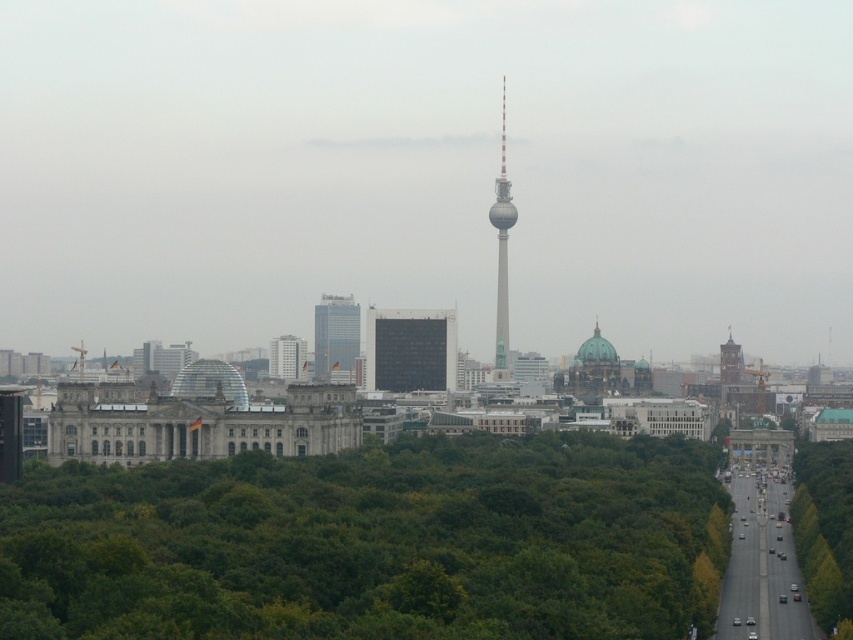
Who is positioned more to the left, black glass building at center or matte glass building at center?

From the viewer's perspective, matte glass building at center appears more on the left side.

Who is lower down, black glass building at center or matte glass building at center?

matte glass building at center is lower down.

Between point (408, 308) and point (277, 360), which one is positioned in front?

Point (408, 308) is in front.

Identify the location of black glass building at center. Image resolution: width=853 pixels, height=640 pixels. (410, 349).

Does green leafy trees at center appear on the right side of green leafy tree at right?

No, green leafy trees at center is not to the right of green leafy tree at right.

Who is shorter, green leafy trees at center or green leafy tree at right?

With less height is green leafy tree at right.

Between point (445, 456) and point (839, 588), which one is positioned behind?

Positioned behind is point (839, 588).

This screenshot has height=640, width=853. Identify the location of green leafy trees at center. (372, 544).

Between black glass building at center and smooth gray tower at center, which one is positioned higher?

smooth gray tower at center is higher up.

Is point (418, 324) closer to viewer compared to point (503, 275)?

No.

Which is in front, point (408, 344) or point (508, 288)?

Point (408, 344)

Locate an element on the screen. black glass building at center is located at coordinates (410, 349).